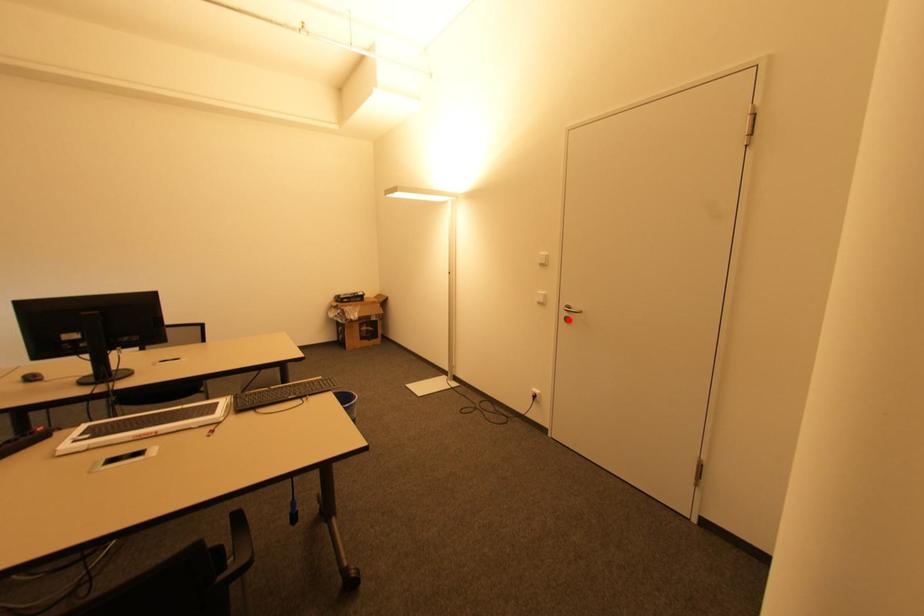
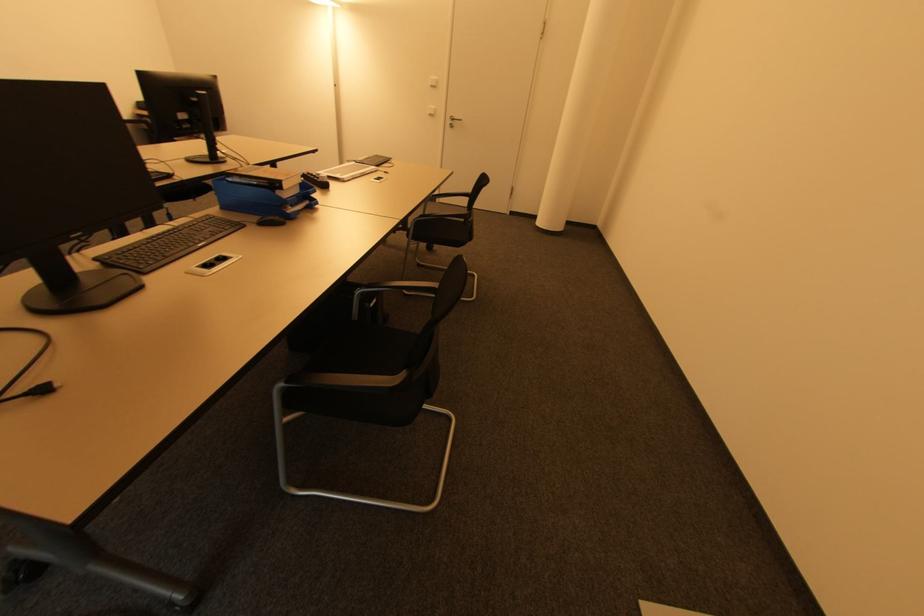
Question: I am providing you with two images of the same scene from different viewpoints. A red point is shown in image1. For the corresponding object point in image2, is it positioned nearer or farther from the camera?

Choices:
 (A) Nearer
 (B) Farther

Answer: (A)